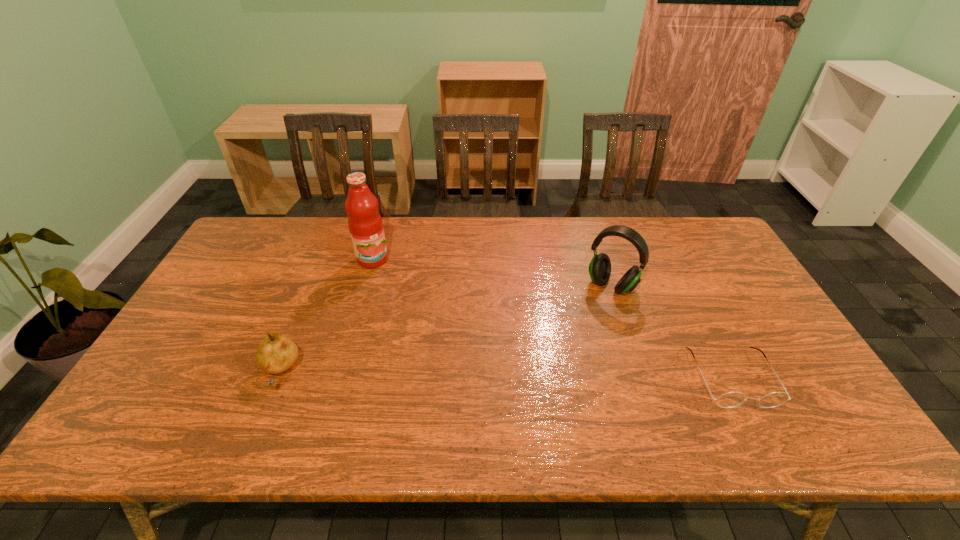
At what (x,y) coordinates should I click in order to perform the action: click on free space on the desktop that is between the leftmost object and the rightmost object and is positioned on the front label of the tallest object. Please return your answer as a coordinate pair (x, y). Image resolution: width=960 pixels, height=540 pixels. Looking at the image, I should click on (449, 374).

Find the location of a particular element. The width and height of the screenshot is (960, 540). free spot on the desktop that is between the leftmost object and the shortest object and is positioned on the ear cups of the third shortest object is located at coordinates (548, 376).